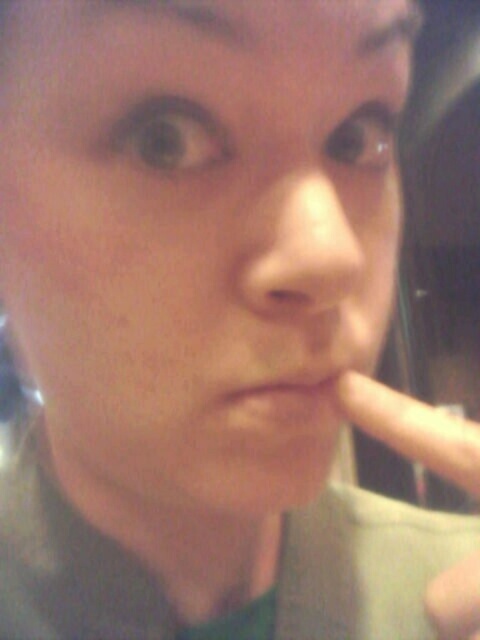
You are analyzing a selfie photo and see two points labeled as point (265,266) and point (286,403). Based on their positions, which point is closer to the camera?

Point (265,266) is in front of point (286,403), so it is closer to the camera.

Looking at this image, you are a photographer adjusting lighting for a portrait. You notice the smooth skin nose at center and matte skin at center in the frame. Which part of the face is more to the right?

The smooth skin nose at center is positioned on the right side of matte skin at center, so the smooth skin nose at center is more to the right.

You are a photographer analyzing a portrait. You notice two areas on the person face in the image. The first is the smooth skin nose at center and the second is the matte skin at center. Which of these two areas is positioned higher on the face?

The smooth skin nose at center is positioned higher on the face than the matte skin at center.